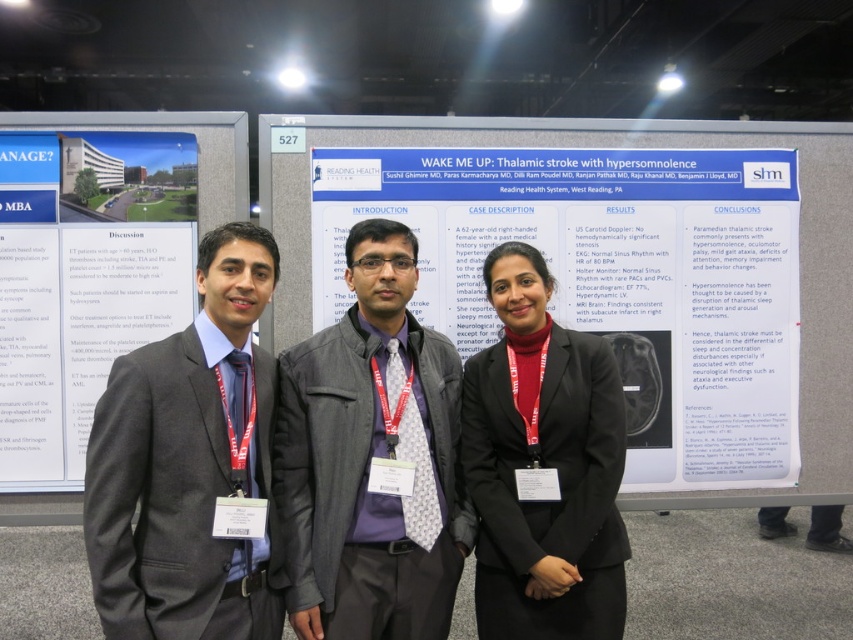
You are an event photographer at the conference. You need to capture a photo of the two presenters wearing the gray fabric jacket at center and the matte black suit at center. Which one is positioned to the right of the other?

The gray fabric jacket at center is to the right of the matte black suit at center.

You are standing at the back of the conference room and want to take a photo of the three individuals. Which of the two points, point (67, 243) or point (575, 400), is closer to you when looking at the presentation board?

Point (67, 243) is closer to you than point (575, 400) because it is further to the camera in the image.